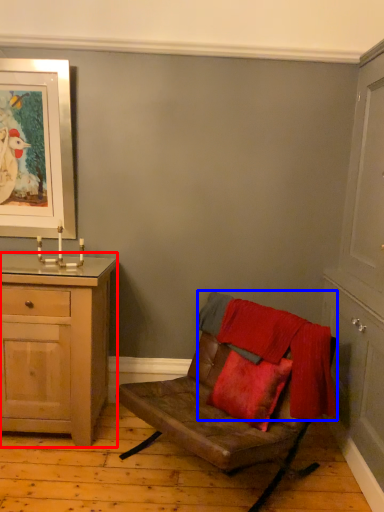
Question: Which of the following is the farthest to the observer, chest of drawers (highlighted by a red box) or blanket (highlighted by a blue box)?

Choices:
 (A) chest of drawers
 (B) blanket

Answer: (A)